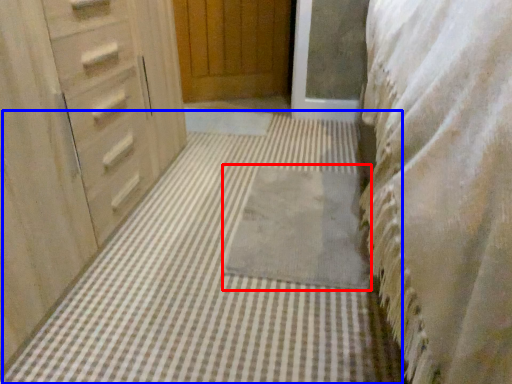
Question: Which object is further to the camera taking this photo, bath mat (highlighted by a red box) or bath mat (highlighted by a blue box)?

Choices:
 (A) bath mat
 (B) bath mat

Answer: (A)